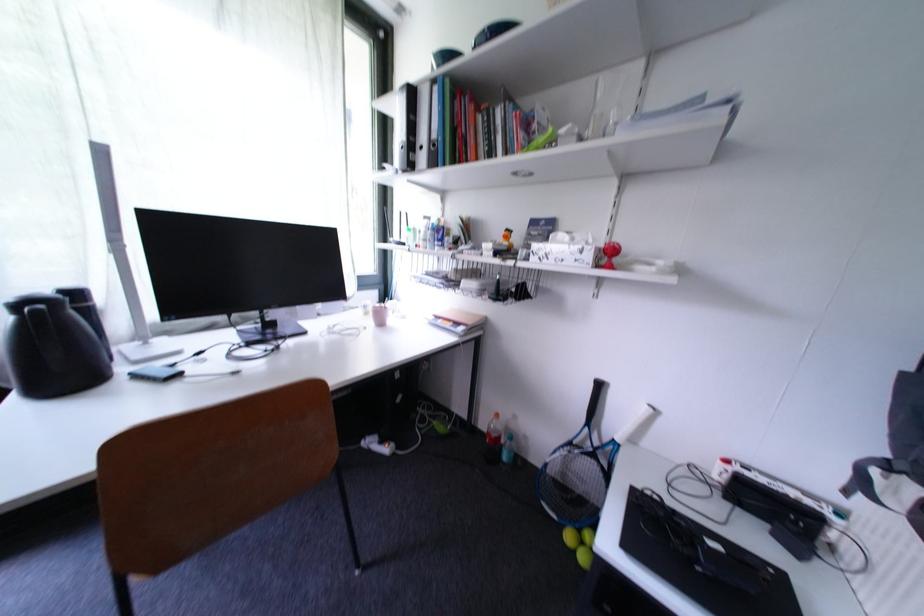
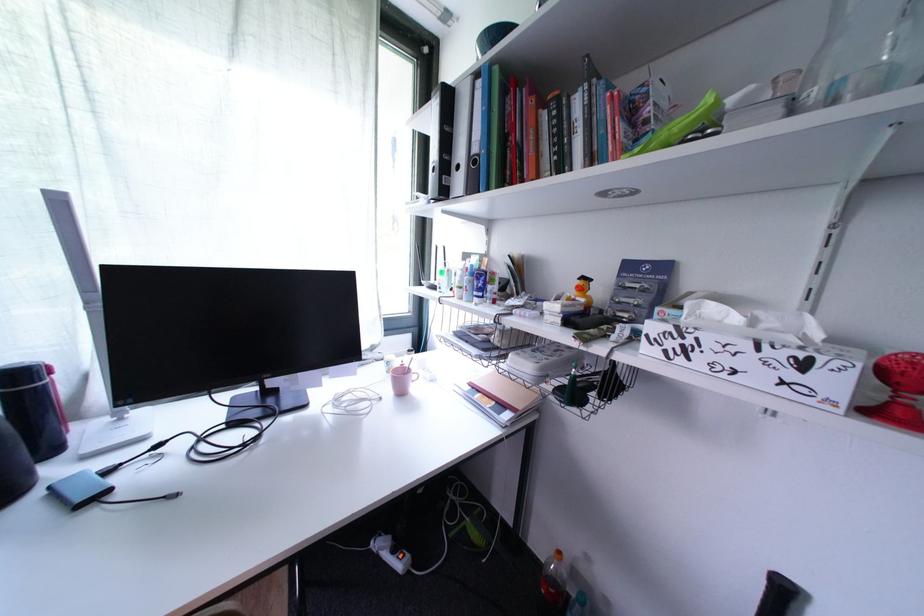
Question: The images are taken continuously from a first-person perspective. In which direction are you moving?

Choices:
 (A) Left
 (B) Right
 (C) Forward
 (D) Backward

Answer: (C)